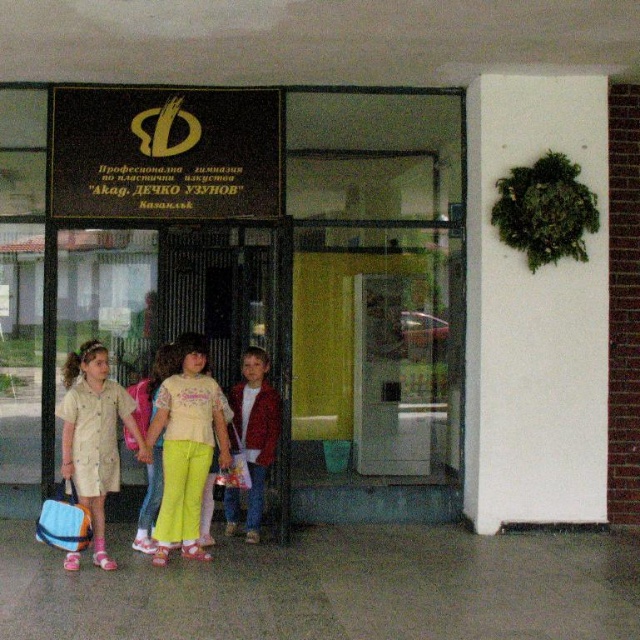
Question: Based on their relative distances, which object is farther from the light yellow cotton shirt at center?

Choices:
 (A) beige cotton dress at center
 (B) red velvet jacket at center

Answer: (B)

Question: Is light yellow cotton shirt at center bigger than beige cotton dress at center?

Choices:
 (A) no
 (B) yes

Answer: (A)

Question: Can you confirm if light yellow cotton shirt at center is positioned above beige cotton dress at center?

Choices:
 (A) yes
 (B) no

Answer: (A)

Question: Which point is closer to the camera?

Choices:
 (A) (166, 387)
 (B) (266, 385)
 (C) (90, 493)

Answer: (C)

Question: Which of the following is the closest to the observer?

Choices:
 (A) red velvet jacket at center
 (B) beige cotton dress at center
 (C) light yellow cotton shirt at center

Answer: (B)

Question: Is light yellow cotton shirt at center bigger than beige cotton dress at center?

Choices:
 (A) no
 (B) yes

Answer: (A)